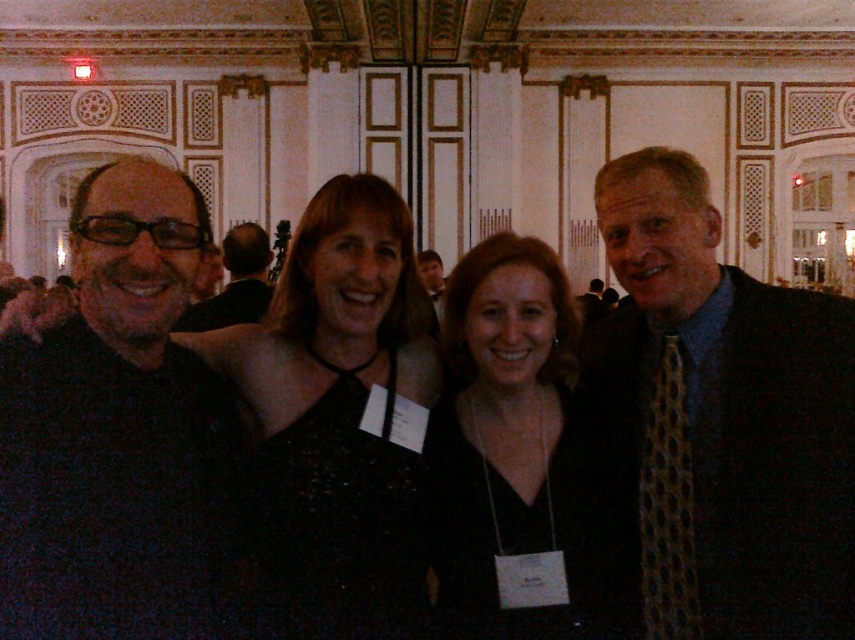
Between point (809, 611) and point (432, 262), which one is positioned in front?

Point (809, 611) is in front.

Image resolution: width=855 pixels, height=640 pixels. Identify the location of patterned silk tie at right. (723, 419).

This screenshot has width=855, height=640. Describe the element at coordinates (723, 419) in the screenshot. I see `patterned silk tie at right` at that location.

This screenshot has width=855, height=640. What are the coordinates of `patterned silk tie at right` in the screenshot? It's located at (x=723, y=419).

Does point (130, 632) come farther from viewer compared to point (520, 396)?

That is False.

Is black matte shirt at left behind black fabric dress at center?

No.

Which is in front, point (168, 237) or point (579, 604)?

Point (579, 604)

Where is `black matte shirt at left`? The image size is (855, 640). black matte shirt at left is located at coordinates (121, 436).

Who is more distant from viewer, (4, 592) or (428, 259)?

Point (428, 259)

Who is positioned more to the left, black matte shirt at left or matte black suit at center?

Positioned to the left is black matte shirt at left.

Where is `black matte shirt at left`? black matte shirt at left is located at coordinates (121, 436).

This screenshot has height=640, width=855. I want to click on black matte shirt at left, so click(121, 436).